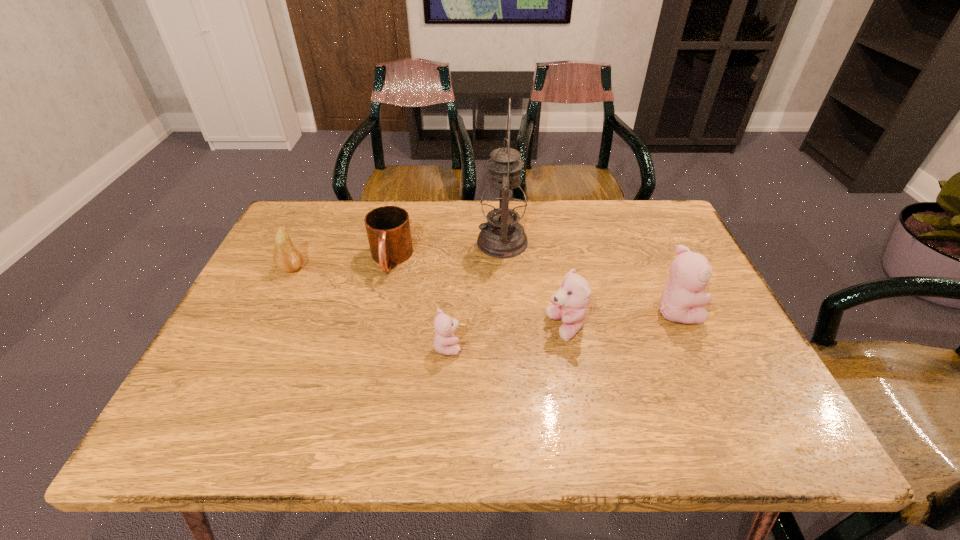
The width and height of the screenshot is (960, 540). Identify the location of the third object from left to right. (445, 343).

Where is `the leftmost teddy bear`? This screenshot has width=960, height=540. the leftmost teddy bear is located at coordinates (445, 343).

Identify the location of the second tallest teddy bear. (570, 301).

Where is `the fifth object from left to right`? This screenshot has width=960, height=540. the fifth object from left to right is located at coordinates pyautogui.click(x=570, y=301).

Image resolution: width=960 pixels, height=540 pixels. Identify the location of the rightmost teddy bear. (681, 302).

Where is `oil lamp`? This screenshot has height=540, width=960. oil lamp is located at coordinates (503, 205).

Find the location of a particular element. The height and width of the screenshot is (540, 960). the fourth object from left to right is located at coordinates (503, 205).

At what (x,y) coordinates should I click in order to perform the action: click on the leftmost object. Please return your answer as a coordinate pair (x, y). Looking at the image, I should click on (287, 257).

Find the location of a particular element. This screenshot has width=960, height=540. mug is located at coordinates (388, 229).

I want to click on vacant region located at the face of the fourth object from right to left, so click(x=620, y=346).